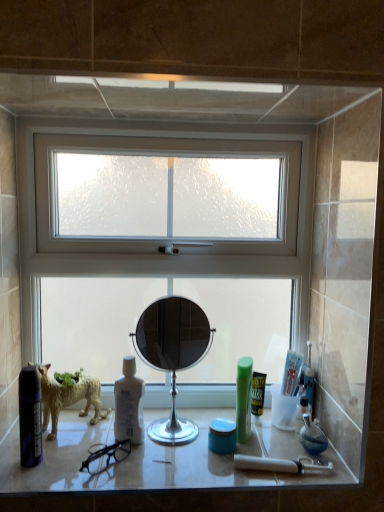
This screenshot has height=512, width=384. Identify the location of unoccupied space behind white glossy mouthwash at center, which ranks as the third mouthwash in right-to-left order. (160, 416).